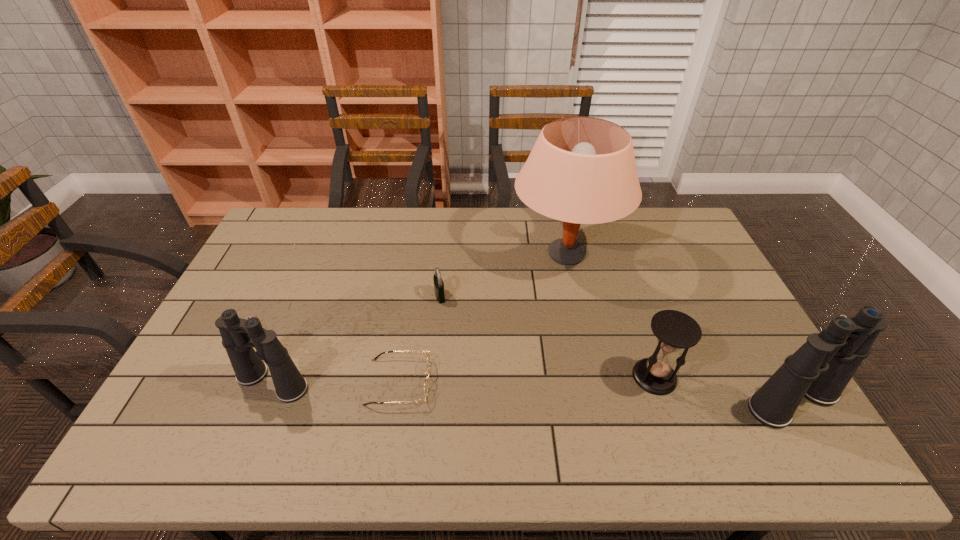
Locate an element on the screen. This screenshot has height=540, width=960. the leftmost object is located at coordinates (239, 336).

At what (x,y) coordinates should I click in order to perform the action: click on the shorter binoculars. Please return your answer as a coordinate pair (x, y). This screenshot has height=540, width=960. Looking at the image, I should click on (239, 336).

Where is `the second tallest object`? The image size is (960, 540). the second tallest object is located at coordinates (821, 368).

Identify the location of the rightmost object. Image resolution: width=960 pixels, height=540 pixels. (821, 368).

I want to click on the second shortest object, so click(438, 282).

You are a GUI agent. You are given a task and a screenshot of the screen. Output one action in this format:
    pyautogui.click(x=<x>, y=<y>)
    Task: Click on the tallest object
    The image size is (960, 540).
    Given the screenshot: What is the action you would take?
    pyautogui.click(x=581, y=170)

At what (x,y) coordinates should I click in order to perform the action: click on the shortest object. Please return your answer as a coordinate pair (x, y). Looking at the image, I should click on (425, 382).

The height and width of the screenshot is (540, 960). Find the location of `hourglass`. hourglass is located at coordinates (675, 330).

The image size is (960, 540). Find the location of `free space located 0.360m on the back of the leftmost object`. free space located 0.360m on the back of the leftmost object is located at coordinates (316, 274).

The width and height of the screenshot is (960, 540). In order to click on vacant space positioned 0.090m on the left of the taller binoculars in this screenshot , I will do `click(708, 401)`.